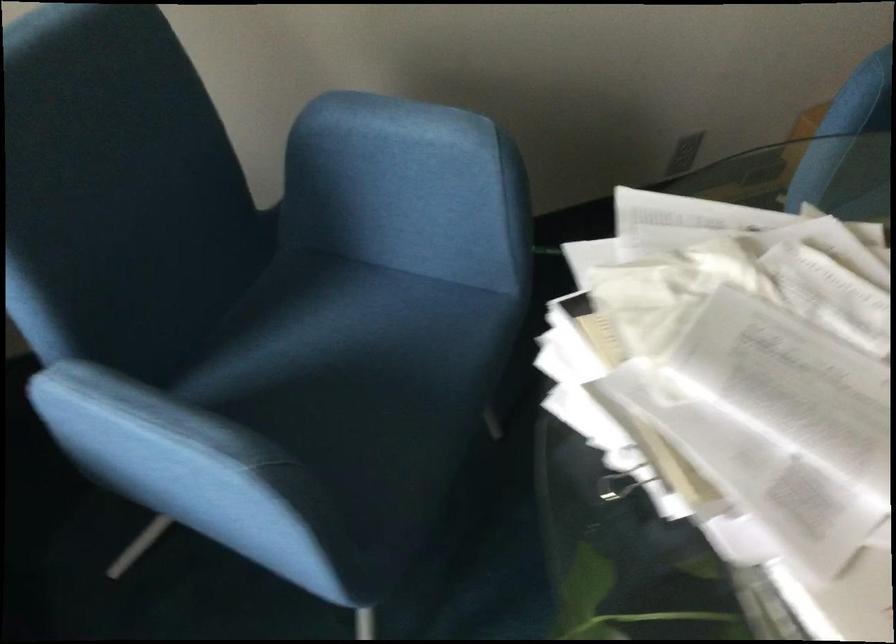
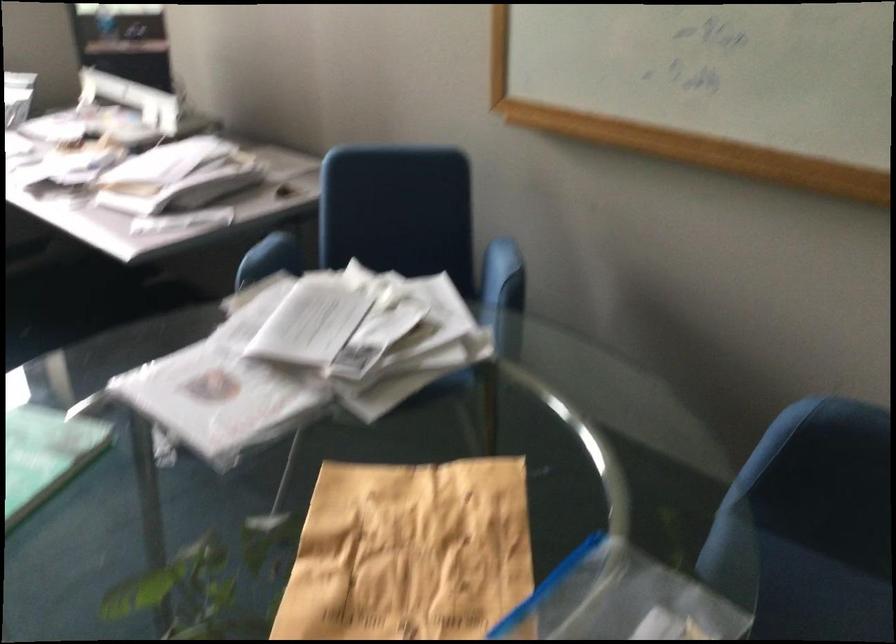
Question: I am providing you with two images of the same scene from different viewpoints. After the viewpoint changes to image2, which objects are now occluded?

Choices:
 (A) black stepladder step
 (B) blue chair armrest
 (C) blue chair sitting surface
 (D) plastic ziplock bag

Answer: (C)